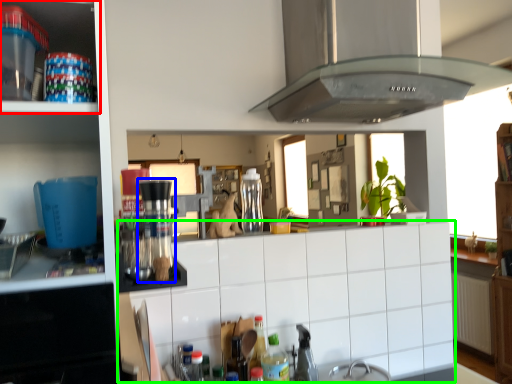
Question: Based on their relative distances, which object is nearer to cabinetry (highlighted by a red box)? Choose from coffee machine (highlighted by a blue box) and counter top (highlighted by a green box).

Choices:
 (A) coffee machine
 (B) counter top

Answer: (A)